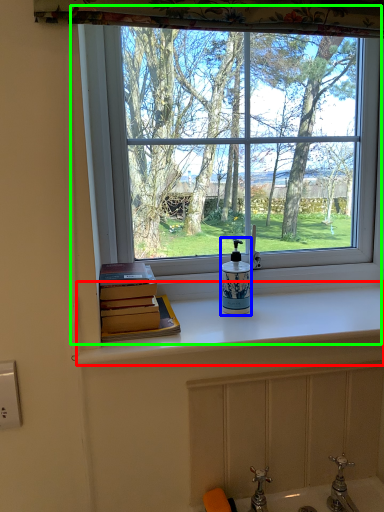
Question: Estimate the real-world distances between objects in this image. Which object is closer to counter top (highlighted by a red box), soap dispenser (highlighted by a blue box) or window (highlighted by a green box)?

Choices:
 (A) soap dispenser
 (B) window

Answer: (A)